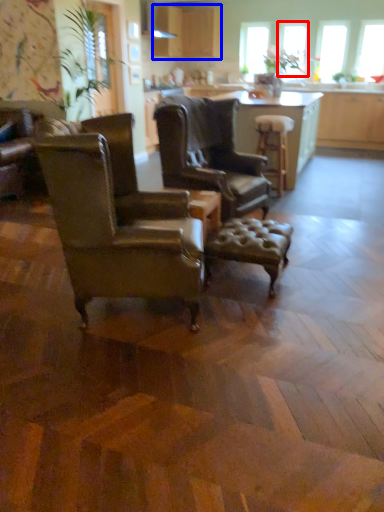
Question: Which point is further to the camera, window screen (highlighted by a red box) or cabinetry (highlighted by a blue box)?

Choices:
 (A) window screen
 (B) cabinetry

Answer: (A)